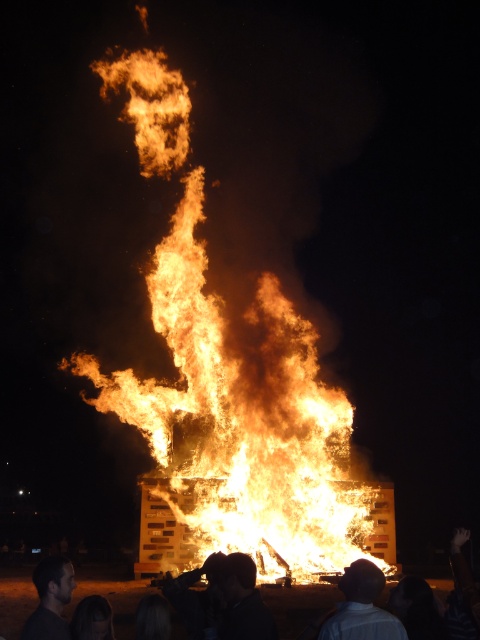
You are standing at the point marked by coordinates point (242, 600) in the image. What do you see immediately in front of you?

You see dark hair at lower center immediately in front of you at point (242, 600).

In the scene shown: You are standing at the center of the bonfire scene. There is a point marked at coordinates (240, 422). What is located at this point?

The point at coordinates (240, 422) marks flaming wood at center.